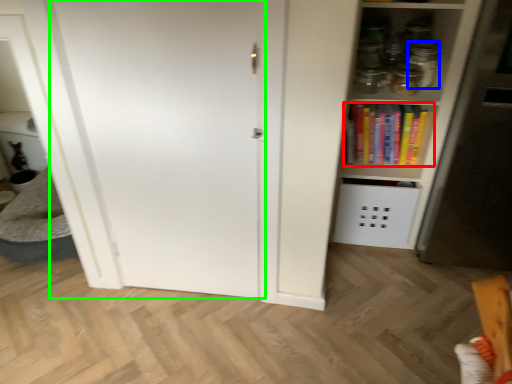
Question: Considering the real-world distances, which object is closest to book (highlighted by a red box)? glass jar (highlighted by a blue box) or door (highlighted by a green box).

Choices:
 (A) glass jar
 (B) door

Answer: (A)